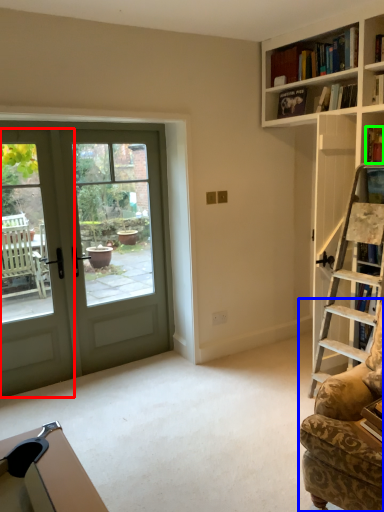
Question: Which object is the closest to the screen door (highlighted by a red box)? Choose among these: rocking chair (highlighted by a blue box) or book (highlighted by a green box).

Choices:
 (A) rocking chair
 (B) book

Answer: (A)